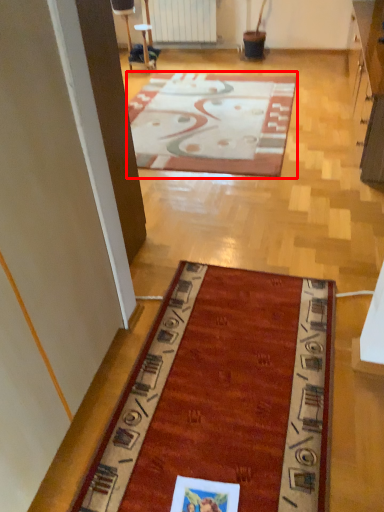
Question: From the image, what is the correct spatial relationship of mat (annotated by the red box) in relation to radiator?

Choices:
 (A) right
 (B) left

Answer: (A)